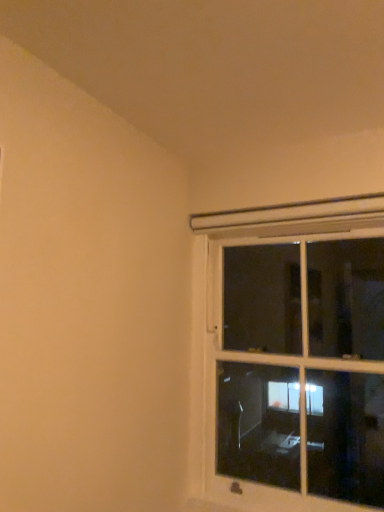
What is the approximate height of white plastic window at upper right?

A: It is 4.13 feet.

Locate an element on the screen. white plastic window at upper right is located at coordinates (294, 355).

Describe the element at coordinates (294, 355) in the screenshot. I see `white plastic window at upper right` at that location.

Find the location of a particular element. The image size is (384, 512). white plastic window at upper right is located at coordinates (294, 355).